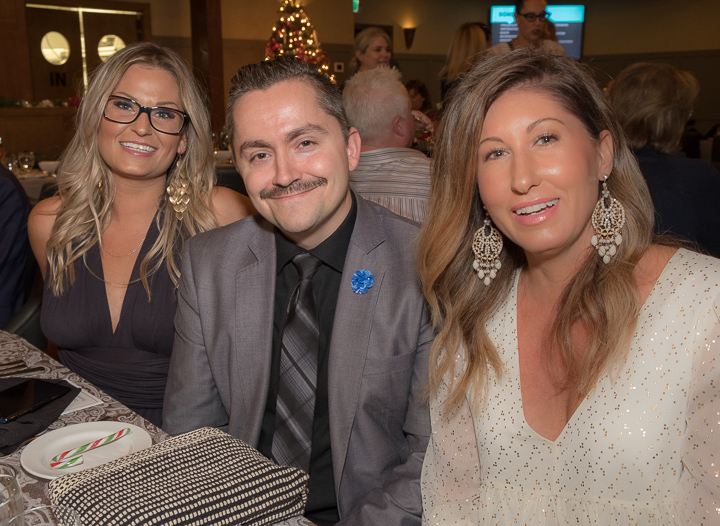
Where is `small plate`? The height and width of the screenshot is (526, 720). small plate is located at coordinates (57, 439).